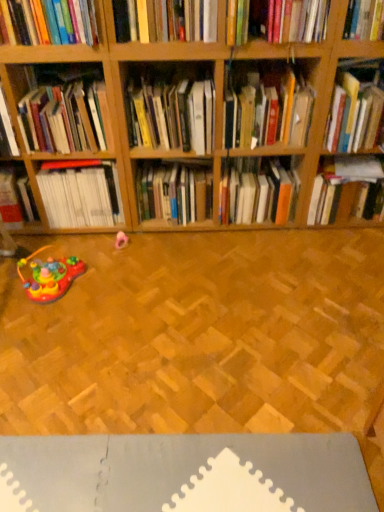
The width and height of the screenshot is (384, 512). Identify the location of spots to the right of pink rubber duck at center, which is the first toy in top-to-bottom order. (159, 245).